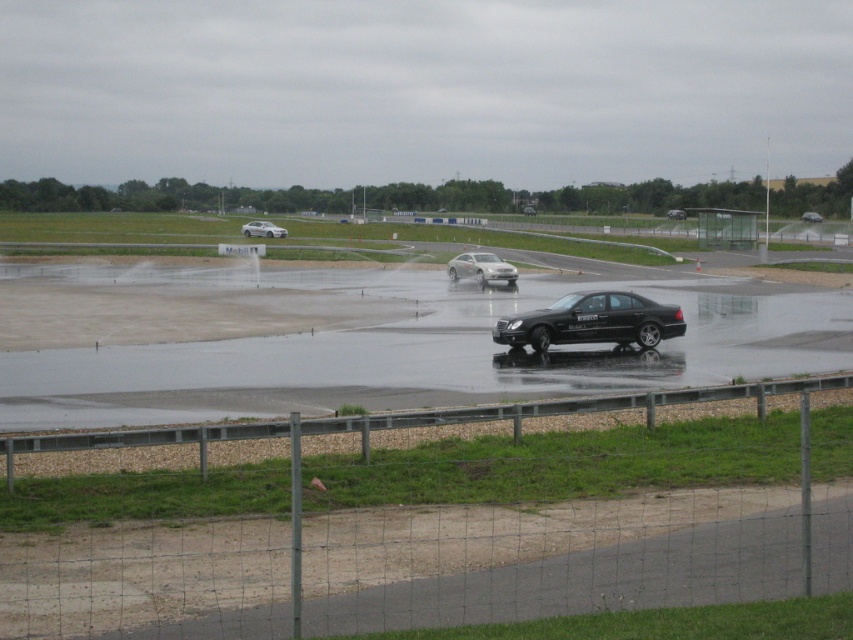
Consider the image. You are a race car driver preparing to overtake the shiny silver sedan at center. You see the satin silver sedan at left on the track. Which car is closer to you as you approach?

The satin silver sedan at left is in front of the shiny silver sedan at center, so it is closer to you as you approach.

You are a race official measuring car widths for track safety. You have a width limit of 1.8 meters. You observe the satin silver sedan at left and the shiny silver sedan at center. Which car is wider and would exceed the limit if the narrower one is exactly at 1.8 meters?

The satin silver sedan at left is wider than the shiny silver sedan at center. If the shiny silver sedan at center is exactly 1.8 meters, then the satin silver sedan at left would exceed the limit.